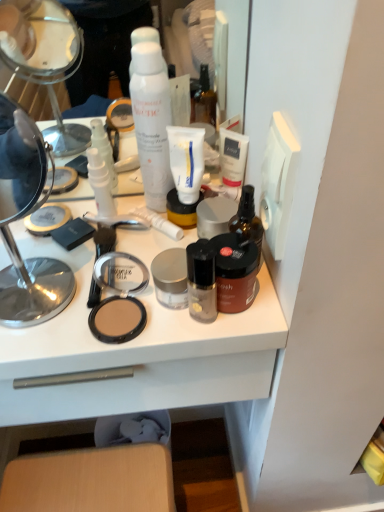
Where is `space that is in front of transparent plastic bottles at center, which is counted as the 5th toiletry, starting from the right`? This screenshot has height=512, width=384. space that is in front of transparent plastic bottles at center, which is counted as the 5th toiletry, starting from the right is located at coordinates pyautogui.click(x=76, y=279).